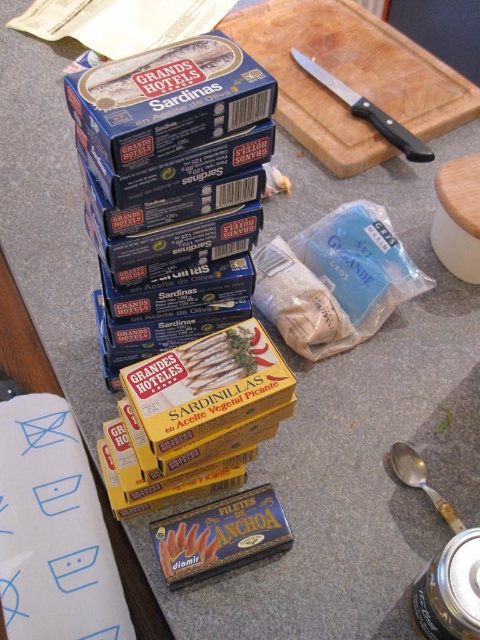
What is the relationship between the width of the blue cardboard box at upper center and the orange matte fish at lower center?

The blue cardboard box at upper center might be wider than the orange matte fish at lower center.

You are a chef preparing a dish and need to move the orange matte fish at lower center to the wooden cutting board at upper right. Given that you can only move items in a straight line, will you be able to do so without any obstacles?

The wooden cutting board at upper right and orange matte fish at lower center are 86.98 centimeters apart. Since there are no mentioned obstacles between them in the scene description, you can move the orange matte fish at lower center to the wooden cutting board at upper right in a straight line.

You are preparing to place a tall glass of water on the kitchen counter. You need to choose between placing it near the wooden cutting board at upper right or the orange matte fish at lower center. Which location would allow the glass to stand without tipping over?

The wooden cutting board at upper right is taller than the orange matte fish at lower center, so placing the glass near the wooden cutting board at upper right would provide a more stable surface to prevent tipping.